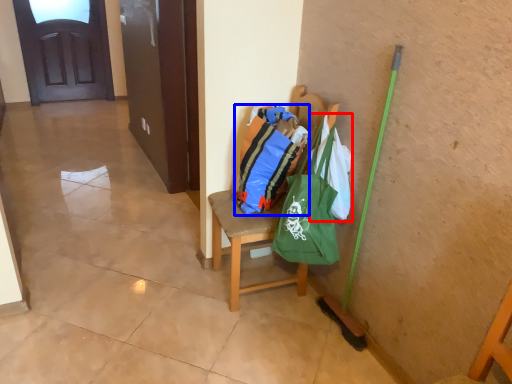
Question: Among these objects, which one is farthest to the camera, grocery bag (highlighted by a red box) or shopping bag (highlighted by a blue box)?

Choices:
 (A) grocery bag
 (B) shopping bag

Answer: (B)